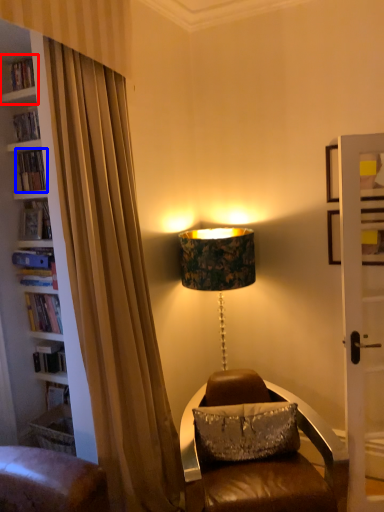
Question: Which point is closer to the camera, shelf (highlighted by a red box) or book (highlighted by a blue box)?

Choices:
 (A) shelf
 (B) book

Answer: (A)